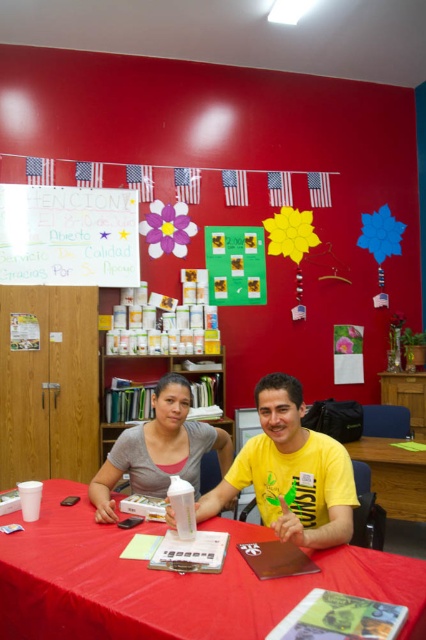
Is colored paper sign at upper left to the right of wooden bookshelf at center from the viewer's perspective?

No, colored paper sign at upper left is not to the right of wooden bookshelf at center.

Which of these two, colored paper sign at upper left or wooden bookshelf at center, stands shorter?

Standing shorter between the two is colored paper sign at upper left.

Is point (74, 284) positioned after point (216, 360)?

No, it is in front of (216, 360).

Find the location of a particular element. colored paper sign at upper left is located at coordinates (69, 236).

Can you confirm if colored paper sign at upper left is positioned to the right of matte white lotion at center?

In fact, colored paper sign at upper left is to the left of matte white lotion at center.

Measure the distance between colored paper sign at upper left and camera.

colored paper sign at upper left and camera are 12.13 feet apart.

Which is in front, point (74, 195) or point (114, 460)?

Point (114, 460) is more forward.

The width and height of the screenshot is (426, 640). Find the location of `colored paper sign at upper left`. colored paper sign at upper left is located at coordinates (69, 236).

Is point (104, 504) closer to viewer compared to point (121, 355)?

Yes.

Can you confirm if matte white lotion at center is positioned below wooden bookshelf at center?

Actually, matte white lotion at center is above wooden bookshelf at center.

Is point (190, 481) closer to camera compared to point (224, 388)?

Yes, it is.

The height and width of the screenshot is (640, 426). In order to click on matte white lotion at center in this screenshot , I will do pos(158,449).